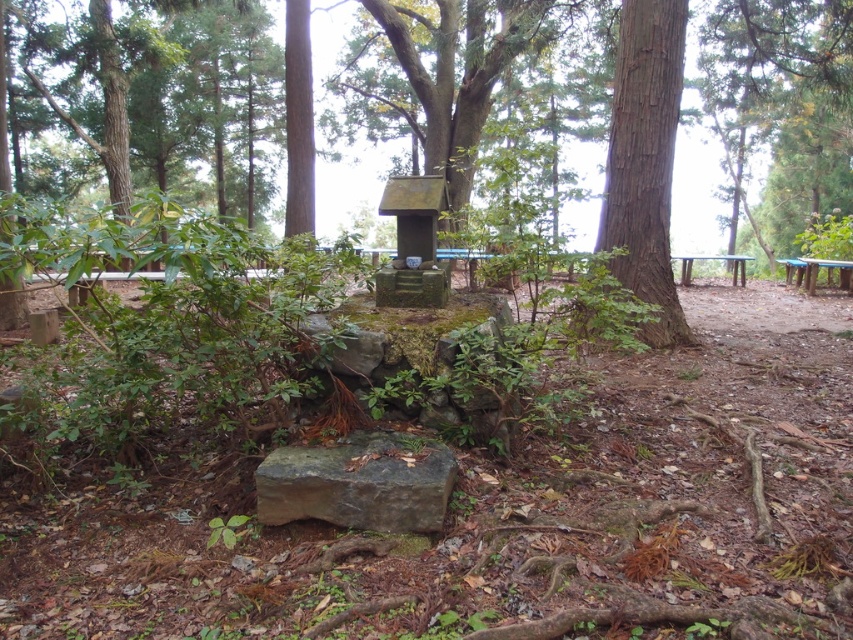
You are standing in the forest and want to reach the shrine. You see the smooth brown tree trunk at right and the blue plastic picnic table at right. Which object is closer to you?

The smooth brown tree trunk at right is closer to you because it is in front of the blue plastic picnic table at right.

You are planning to set up a picnic in the forest area shown. You have a choice between the blue plastic picnic table at right and the wooden picnic table at right. Which table would you choose if you want one that is taller?

The wooden picnic table at right is taller than the blue plastic picnic table at right, so you should choose the wooden picnic table at right if you want a taller table.

You are planning to set up a picnic in this forest area and have brought a heavy basket. You want to place it on the picnic table that is higher up. Which picnic table should you choose between the blue plastic picnic table at right and the wooden picnic table at right?

The wooden picnic table at right is higher up, so you should choose the wooden picnic table at right to place your heavy basket.